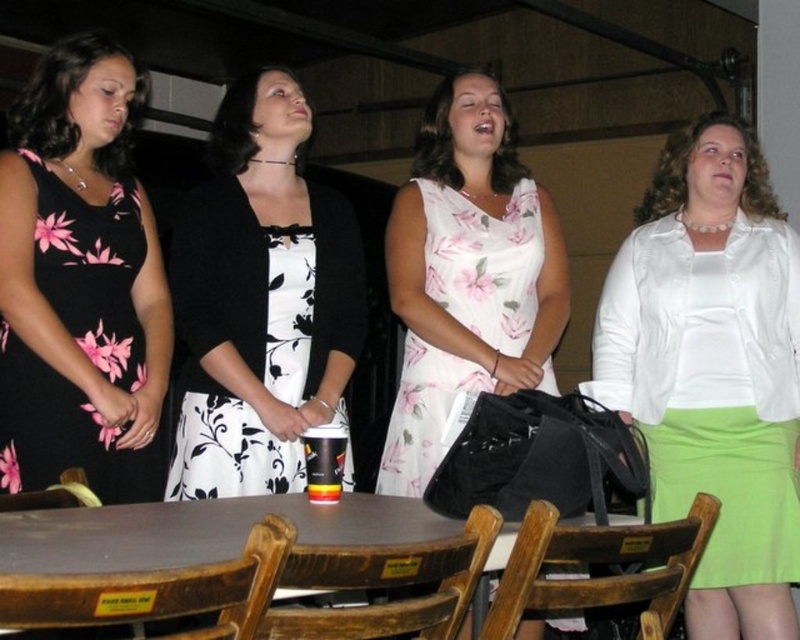
Who is positioned more to the left, black floral dress at left or brown wooden table at center?

From the viewer's perspective, black floral dress at left appears more on the left side.

Describe the element at coordinates (92, 269) in the screenshot. The width and height of the screenshot is (800, 640). I see `black floral dress at left` at that location.

Is point (92, 337) positioned in front of point (236, 508)?

No, (92, 337) is behind (236, 508).

Where is `black floral dress at left`? This screenshot has height=640, width=800. black floral dress at left is located at coordinates (92, 269).

Is black floral dress at center wider than black floral dress at left?

Yes.

Who is more forward, [236,365] or [28,394]?

Positioned in front is point [28,394].

Image resolution: width=800 pixels, height=640 pixels. Identify the location of black floral dress at center. (260, 300).

Can you confirm if black floral dress at center is taller than brown wooden table at center?

Correct, black floral dress at center is much taller as brown wooden table at center.

Can you confirm if black floral dress at center is thinner than brown wooden table at center?

Yes, black floral dress at center is thinner than brown wooden table at center.

Locate an element on the screen. black floral dress at center is located at coordinates (260, 300).

Identify the location of black floral dress at center. 260,300.